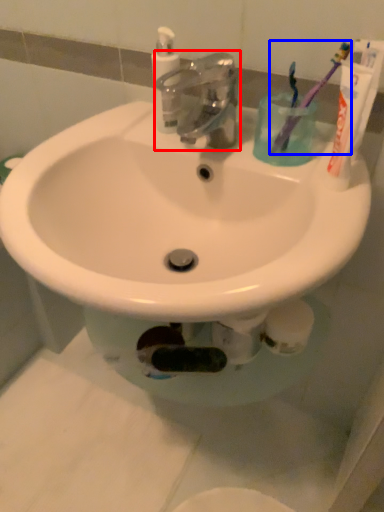
Question: Which object is further to the camera taking this photo, tap (highlighted by a red box) or toothbrush (highlighted by a blue box)?

Choices:
 (A) tap
 (B) toothbrush

Answer: (B)